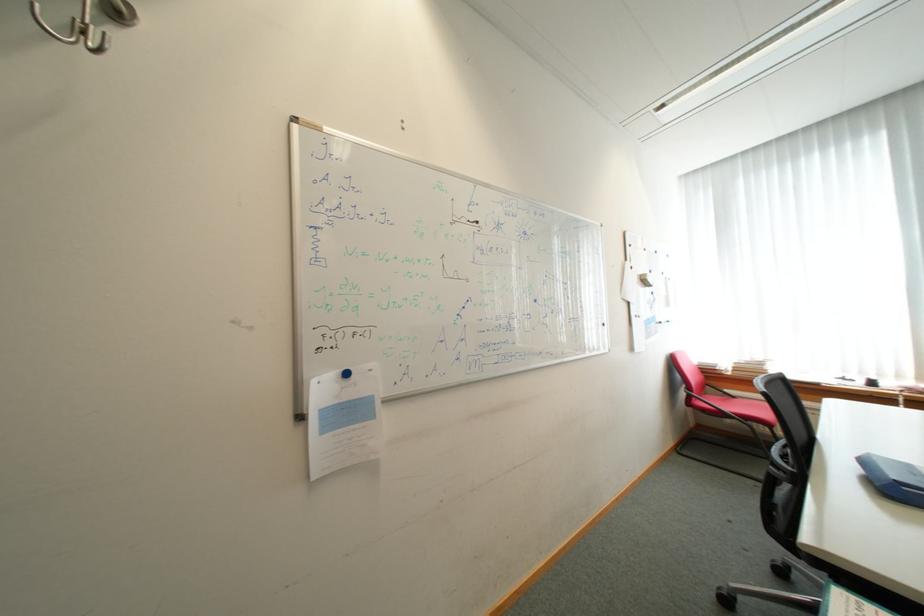
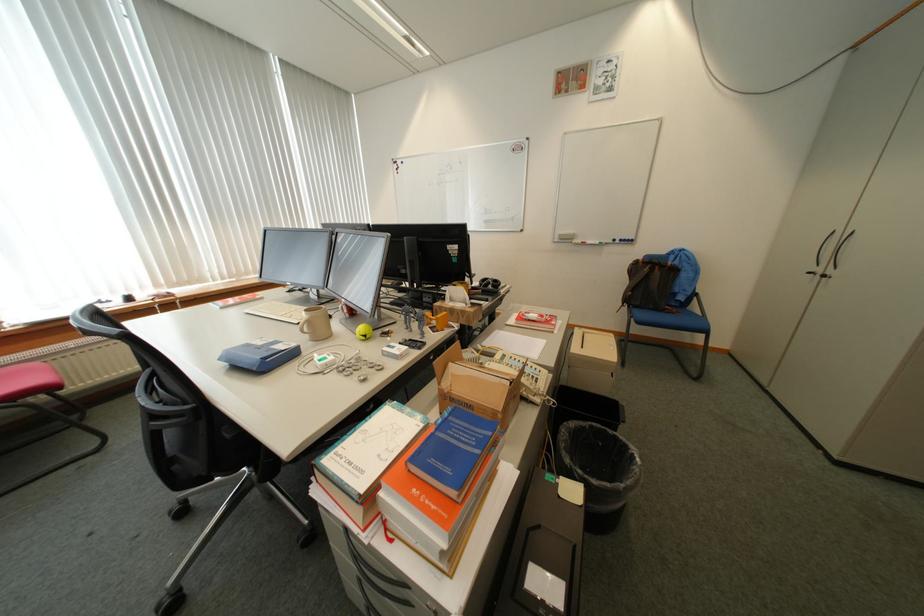
The images are taken continuously from a first-person perspective. In which direction is your viewpoint rotating?

The camera rotated toward right-down.